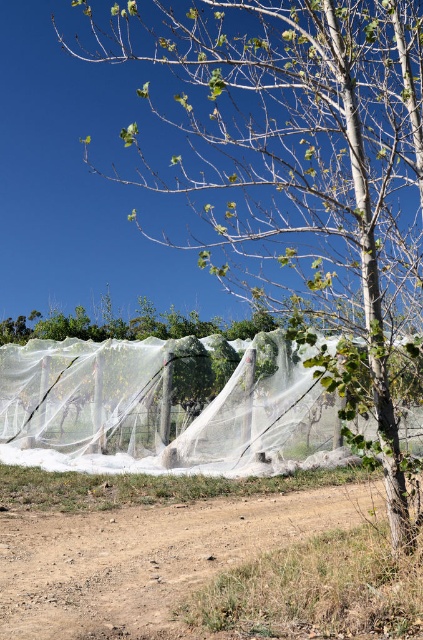
Between brown dirt field at lower center and transparent nylon net at center, which one appears on the left side from the viewer's perspective?

Positioned to the left is transparent nylon net at center.

Can you confirm if brown dirt field at lower center is bigger than transparent nylon net at center?

No, brown dirt field at lower center is not bigger than transparent nylon net at center.

Measure the distance between brown dirt field at lower center and camera.

13.71 feet

This screenshot has height=640, width=423. Find the location of `brown dirt field at lower center`. brown dirt field at lower center is located at coordinates (209, 570).